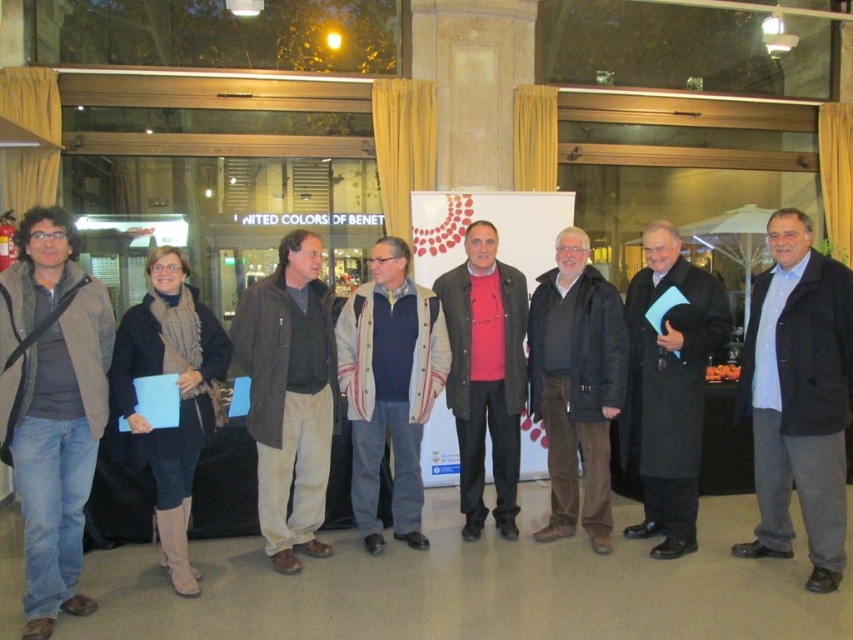
You are standing in the room and want to move from the point at coordinate point [827,458] to the point at coordinate point [595,355]. Is the destination point closer to the front or the back of the room compared to the starting point?

The destination point at coordinate point [595,355] is behind the starting point at coordinate point [827,458], so it is closer to the back of the room.

You are a photographer trying to capture a closeup of the brown corduroy jacket at center and the pink matte sweater at center in the group photo. Given that your camera can only focus on objects within a 1 meter range, will you be able to capture both items in focus?

The distance between the brown corduroy jacket at center and the pink matte sweater at center is 89.37 centimeters, which is less than 1 meter. Therefore, the camera can focus on both items within the required range.

The scene shows a group of people at an indoor event with a banner and a store sign visible. There is a specific point in the image at coordinates (x=389, y=387). What object is located at that exact point?

The object at point (x=389, y=387) is the knitted wool sweater at center.